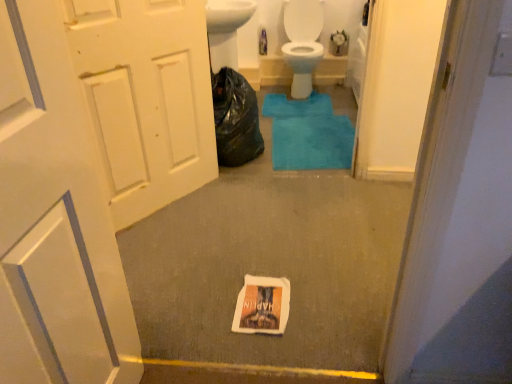
The image size is (512, 384). I want to click on free spot behind white paper flyer at center, so click(261, 261).